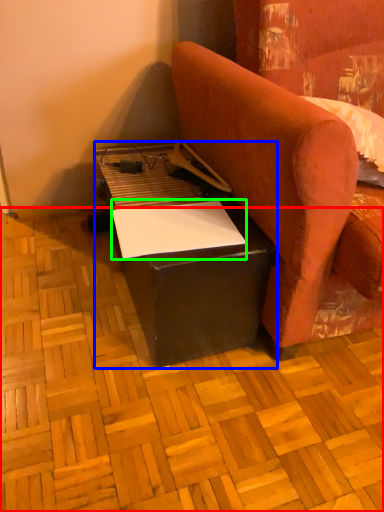
Question: Which object is positioned closest to plywood (highlighted by a red box)? Select from table (highlighted by a blue box) and notepad (highlighted by a green box).

Choices:
 (A) table
 (B) notepad

Answer: (A)